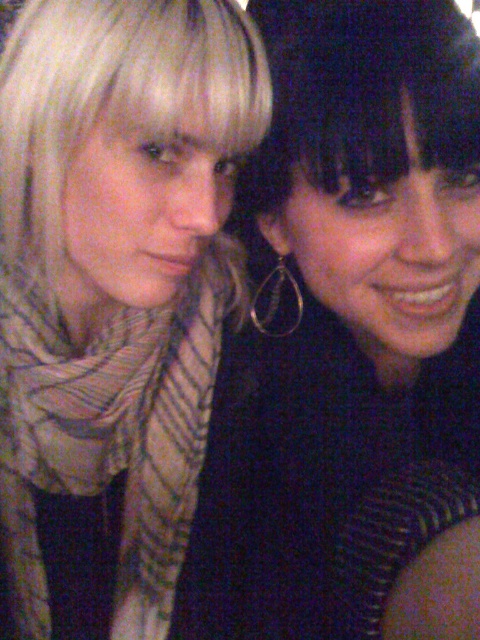
Image resolution: width=480 pixels, height=640 pixels. Describe the element at coordinates (381, 291) in the screenshot. I see `matte black top at center` at that location.

Does point (408, 420) come in front of point (101, 3)?

No, (408, 420) is behind (101, 3).

Locate an element on the screen. matte black top at center is located at coordinates (381, 291).

Does striped scarf at left appear under matte black top at center?

Correct, striped scarf at left is located below matte black top at center.

Is striped scarf at left to the left of matte black top at center from the viewer's perspective?

Correct, you'll find striped scarf at left to the left of matte black top at center.

Who is more forward, (164,150) or (400,54)?

Point (400,54) is in front.

At what (x,y) coordinates should I click in order to perform the action: click on striped scarf at left. Please return your answer as a coordinate pair (x, y). This screenshot has width=480, height=640. Looking at the image, I should click on (115, 291).

Measure the distance between point [229,285] and camera.

The distance of point [229,285] from camera is 33.68 inches.

Is striped scarf at left smaller than blondehair at left?

Incorrect, striped scarf at left is not smaller in size than blondehair at left.

Who is more distant from viewer, (87, 65) or (147, 100)?

Point (87, 65)

Locate an element on the screen. The height and width of the screenshot is (640, 480). striped scarf at left is located at coordinates (115, 291).